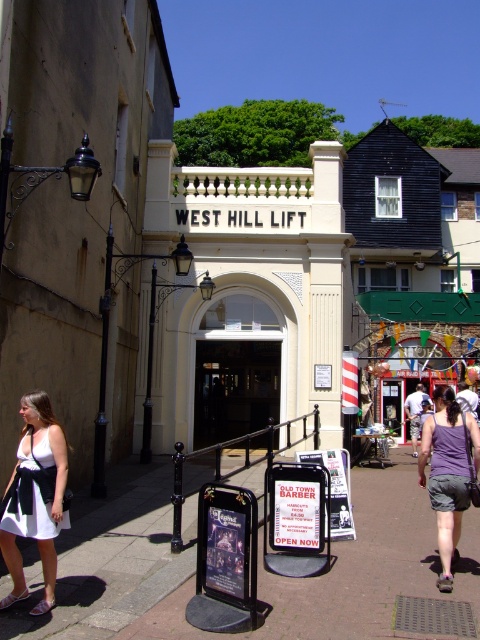
Is point (106, 634) positioned behind point (254, 365)?

No, (106, 634) is in front of (254, 365).

Between point (159, 573) and point (232, 403), which one is positioned behind?

Positioned behind is point (232, 403).

Identify the location of brown stone pavement at center. (361, 563).

Is white matte dress at lower left thinner than purple fabric shorts at lower right?

Yes, white matte dress at lower left is thinner than purple fabric shorts at lower right.

Can you confirm if white matte dress at lower left is positioned to the right of purple fabric shorts at lower right?

Incorrect, white matte dress at lower left is not on the right side of purple fabric shorts at lower right.

Who is more distant from viewer, (x=51, y=412) or (x=442, y=582)?

Point (x=442, y=582)

Locate an element on the screen. white matte dress at lower left is located at coordinates (35, 499).

Is white matte dress at lower left wider than transparent glass door at center?

No.

Does white matte dress at lower left appear over transparent glass door at center?

Correct, white matte dress at lower left is located above transparent glass door at center.

Does point (12, 474) come behind point (227, 417)?

No, it is in front of (227, 417).

This screenshot has width=480, height=640. What are the coordinates of `white matte dress at lower left` in the screenshot? It's located at (35, 499).